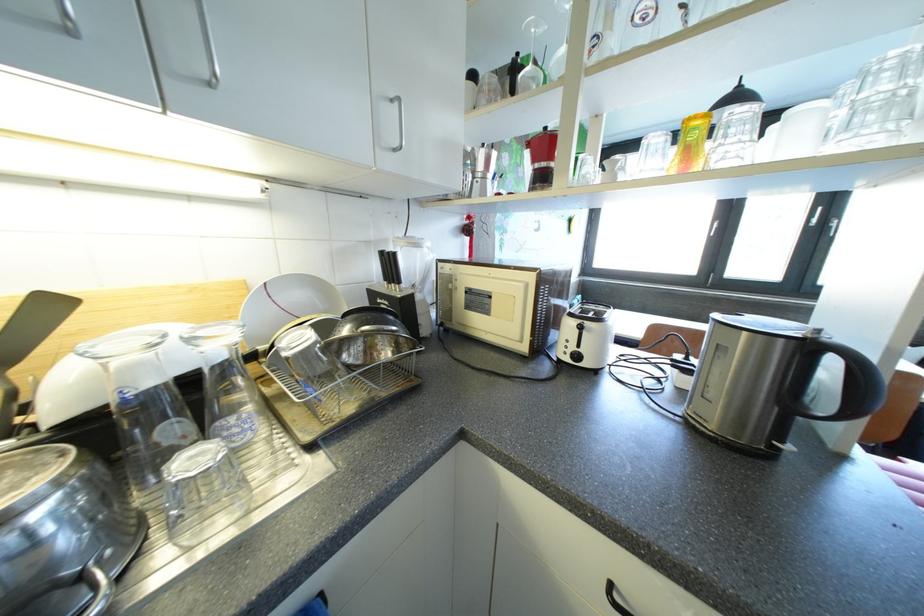
The height and width of the screenshot is (616, 924). Describe the element at coordinates (614, 599) in the screenshot. I see `a black cabinet handle` at that location.